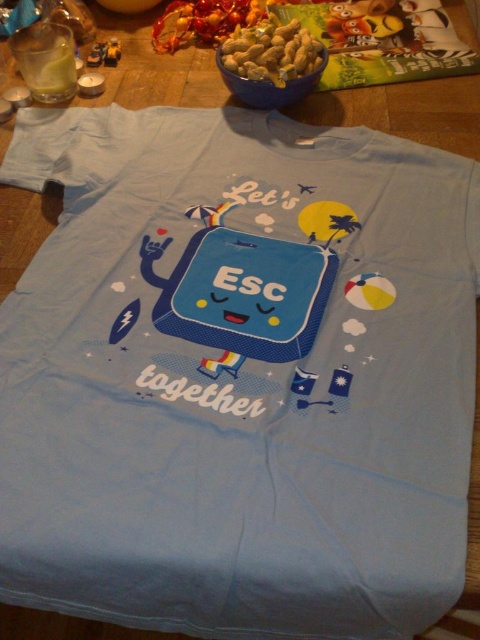
You are organizing items on a wooden table and notice the smooth brown cereal at upper center. Where exactly is it placed relative to the light blue T shirt?

The smooth brown cereal at upper center is located at point coordinates 0.083 on the x axis and 0.565 on the y axis relative to the light blue T shirt.

You are organizing a toy store shelf and need to arrange the cartoonish plastic toy at upper center and the yellow plastic toy at upper left. If you want to place them side by side without overlapping, which toy should you place first to accommodate their widths?

The cartoonish plastic toy at upper center has a greater width than the yellow plastic toy at upper left, so you should place the cartoonish plastic toy at upper center first to ensure there is enough space for both toys on the shelf.

You are organizing a toy collection and need to place the shiny plastic toy at upper center and the yellow plastic toy at upper left. Which toy is closer to you when viewed from the front?

The shiny plastic toy at upper center is closer to you because the yellow plastic toy at upper left is behind it.